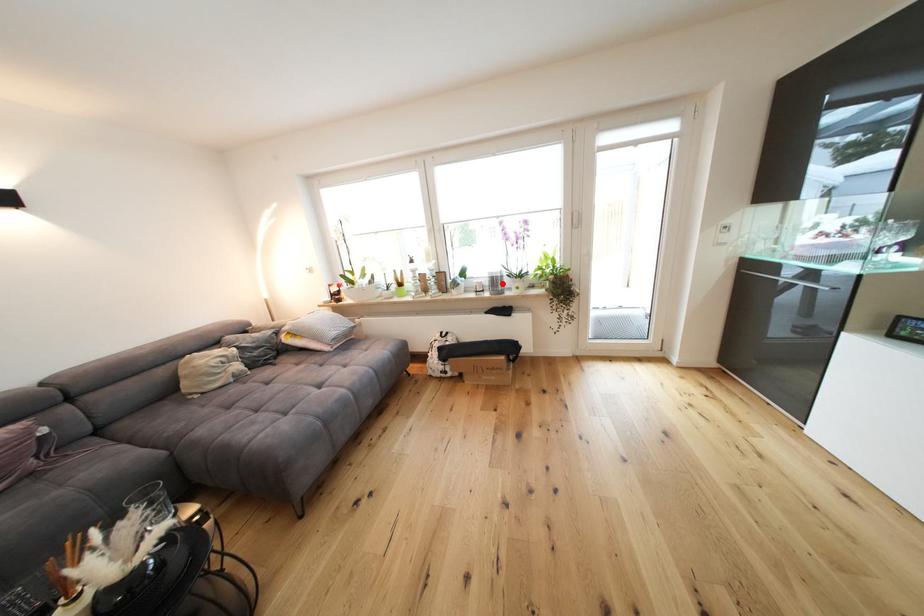
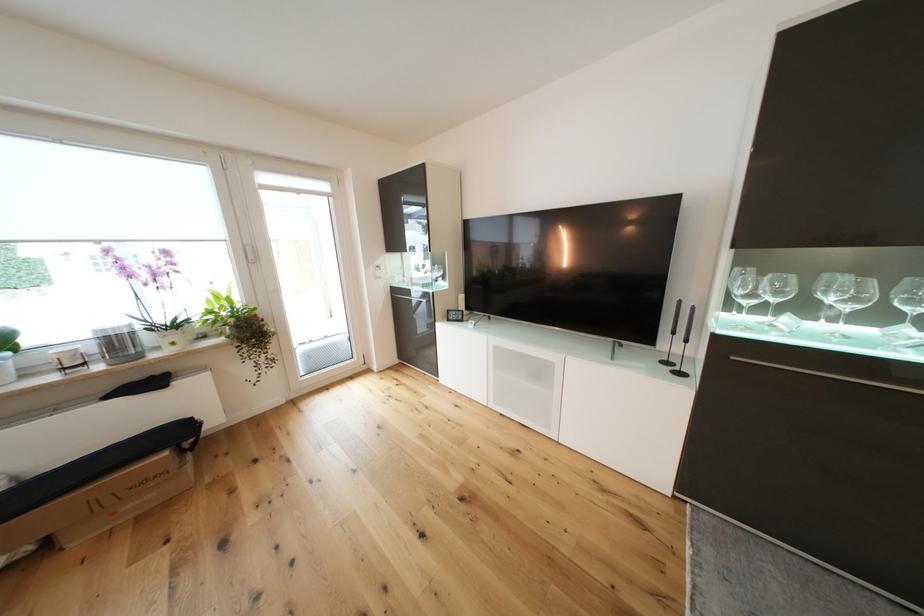
Where in the second image is the point corresponding to the highlighted location from the first image?

(124, 345)